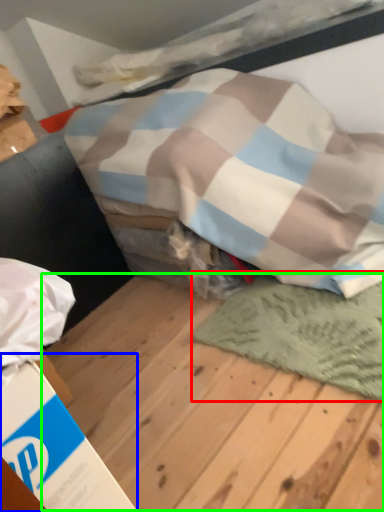
Question: Considering the real-world distances, which object is closest to mat (highlighted by a red box)? cardboard box (highlighted by a blue box) or plywood (highlighted by a green box).

Choices:
 (A) cardboard box
 (B) plywood

Answer: (B)